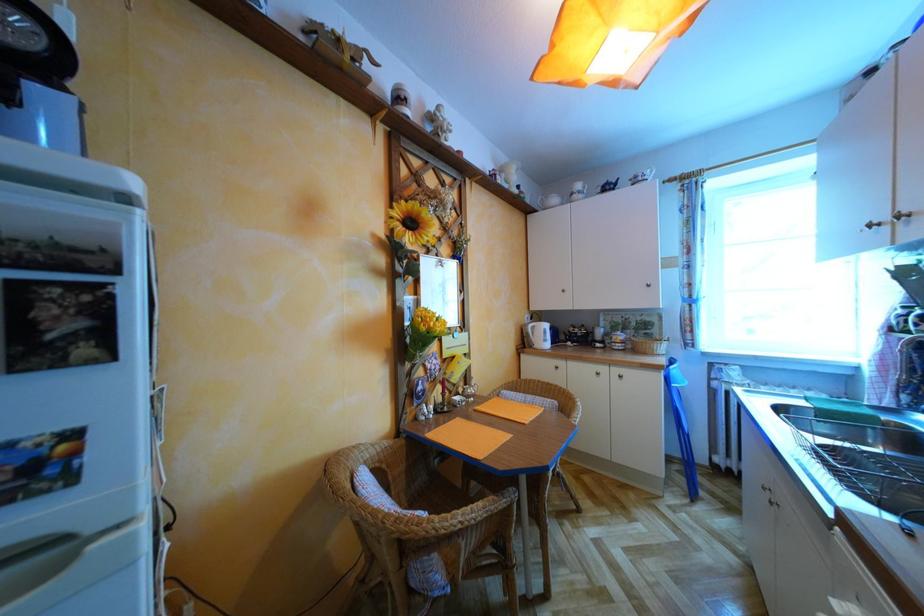
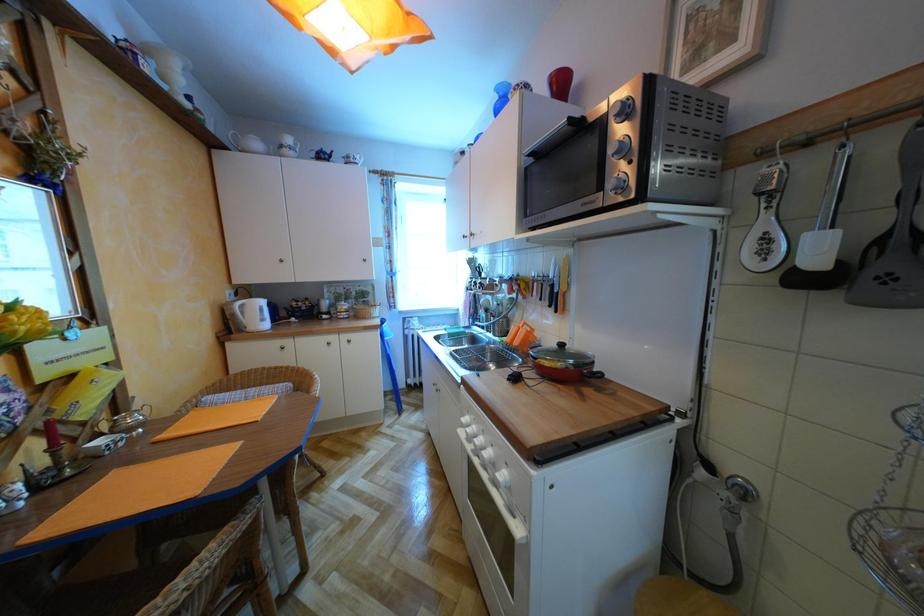
Question: The camera is either moving clockwise (left) or counter-clockwise (right) around the object. The first image is from the beginning of the video and the second image is from the end. Is the camera moving left or right when shooting the video?

Choices:
 (A) Left
 (B) Right

Answer: (A)